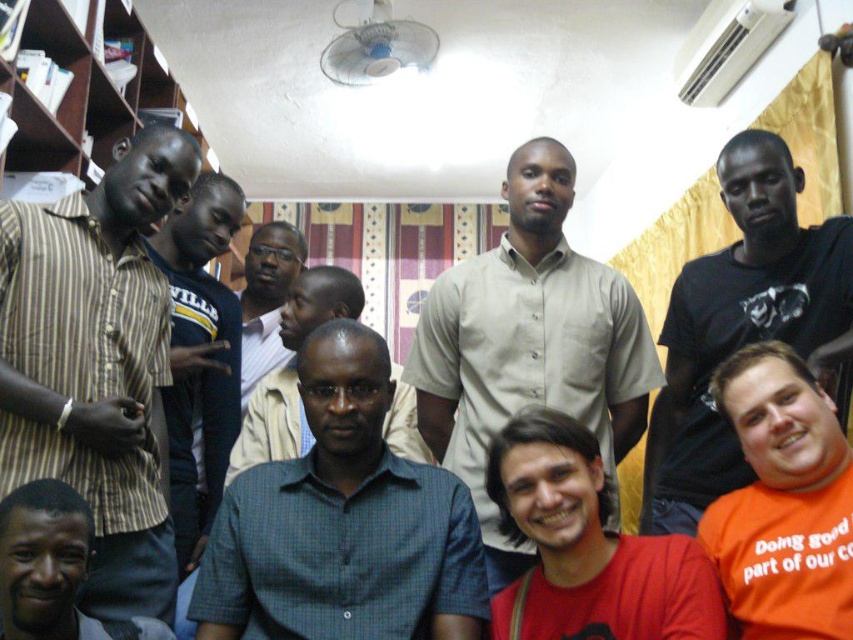
You are standing in the room and want to reach a point that is 5 feet away from you. Is the point at coordinates point (122, 554) within reach?

The distance of point (122, 554) from viewer is 5.05 feet, so the point is slightly out of reach since it is just over 5 feet away.

You are observing a group of people in a room. You notice two shirts at the center of the image, a light beige shirt at center and a dark green shirt at center. Which shirt is positioned higher in the image?

→ The light beige shirt at center is positioned higher than the dark green shirt at center in the image.

You are standing in a room with a ceiling fan and bookshelves. There is a point at coordinates (448, 310) that you want to reach. If you can move forward 6 feet, will you be able to reach that point?

The distance between you and the point at coordinates (448, 310) is 6.06 feet. Since you can move forward 6 feet, you will not quite reach the point as you are still 0.06 feet short.